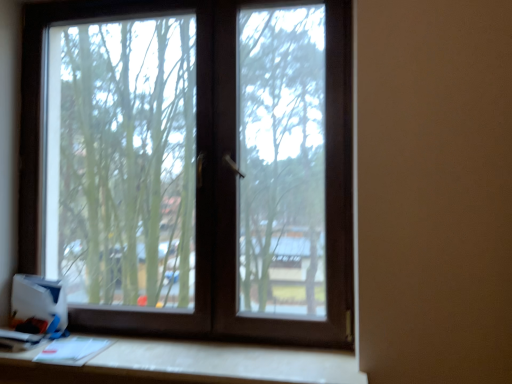
Where is `vacant area to the right of white cardboard box at lower left`? This screenshot has height=384, width=512. vacant area to the right of white cardboard box at lower left is located at coordinates (73, 339).